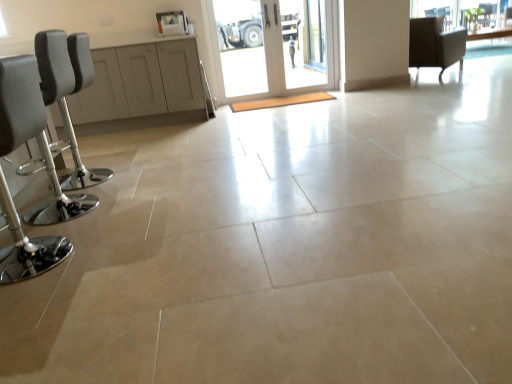
Question: Is clear glass window screen at upper right to the right of transparent glass door at center from the viewer's perspective?

Choices:
 (A) yes
 (B) no

Answer: (A)

Question: Can you confirm if clear glass window screen at upper right is bigger than transparent glass door at center?

Choices:
 (A) yes
 (B) no

Answer: (B)

Question: From the image's perspective, is clear glass window screen at upper right under transparent glass door at center?

Choices:
 (A) yes
 (B) no

Answer: (B)

Question: Is clear glass window screen at upper right at the left side of transparent glass door at center?

Choices:
 (A) yes
 (B) no

Answer: (B)

Question: Considering the relative sizes of clear glass window screen at upper right and transparent glass door at center in the image provided, is clear glass window screen at upper right wider than transparent glass door at center?

Choices:
 (A) yes
 (B) no

Answer: (A)

Question: Is clear glass window screen at upper right further to the viewer compared to transparent glass door at center?

Choices:
 (A) no
 (B) yes

Answer: (B)

Question: Considering the relative positions of transparent glass door at center and metallic chrome barstool at left, positioned as the 2th chair in right-to-left order, in the image provided, is transparent glass door at center to the left of metallic chrome barstool at left, positioned as the 2th chair in right-to-left order, from the viewer's perspective?

Choices:
 (A) no
 (B) yes

Answer: (A)

Question: Is transparent glass door at center positioned in front of metallic chrome barstool at left, placed as the 1th chair when sorted from bottom to top?

Choices:
 (A) yes
 (B) no

Answer: (B)

Question: Is transparent glass door at center taller than metallic chrome barstool at left, positioned as the 2th chair in right-to-left order?

Choices:
 (A) yes
 (B) no

Answer: (A)

Question: Can you confirm if transparent glass door at center is smaller than metallic chrome barstool at left, the first chair when ordered from front to back?

Choices:
 (A) yes
 (B) no

Answer: (A)

Question: Is transparent glass door at center further to camera compared to metallic chrome barstool at left, positioned as the 2th chair in right-to-left order?

Choices:
 (A) no
 (B) yes

Answer: (B)

Question: Could you tell me if transparent glass door at center is facing metallic chrome barstool at left, placed as the 1th chair when sorted from bottom to top?

Choices:
 (A) no
 (B) yes

Answer: (A)

Question: From the image's perspective, is clear glass window at upper right beneath black leather barstool at left, the second chair ordered from the bottom?

Choices:
 (A) no
 (B) yes

Answer: (A)